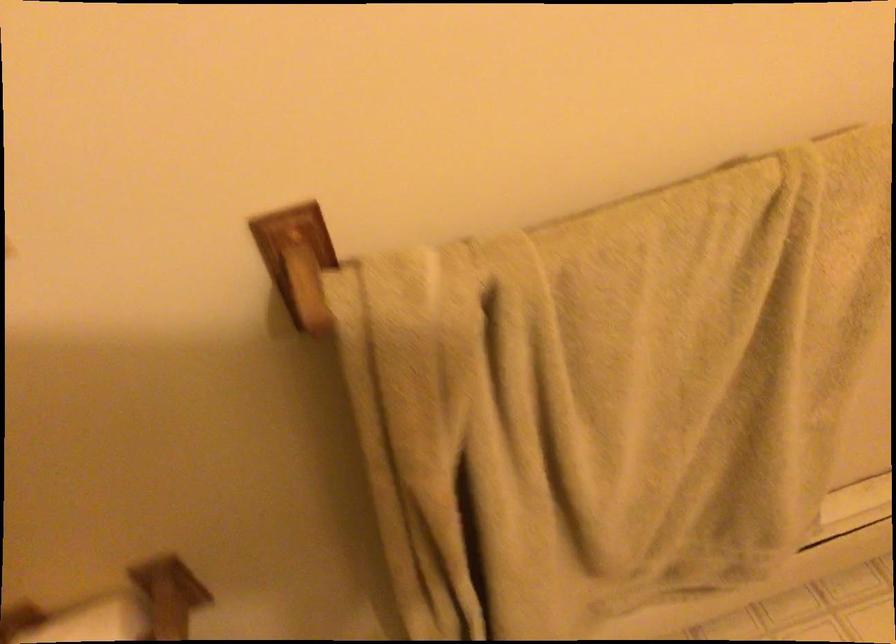
Find the location of a particular element. Image resolution: width=896 pixels, height=644 pixels. towel rack bar is located at coordinates (297, 260).